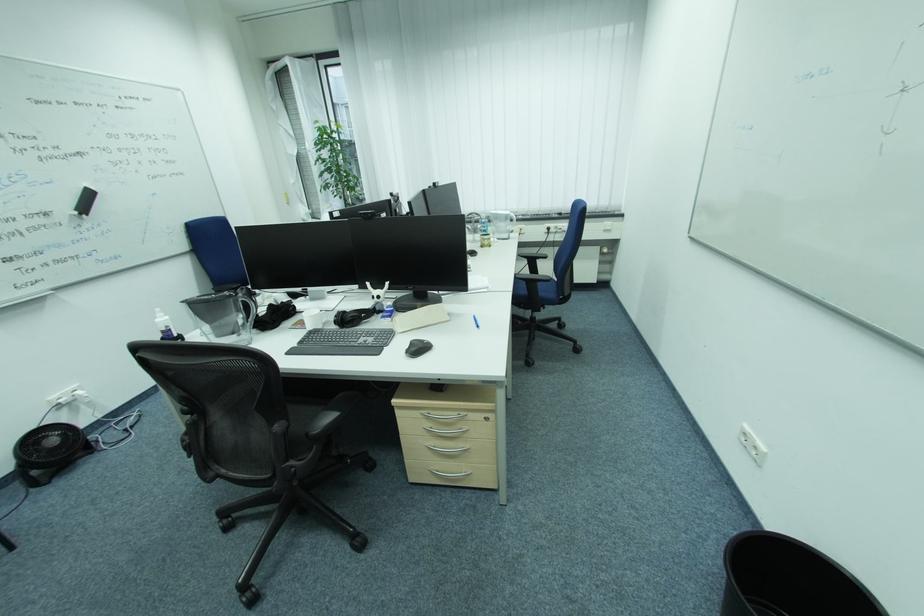
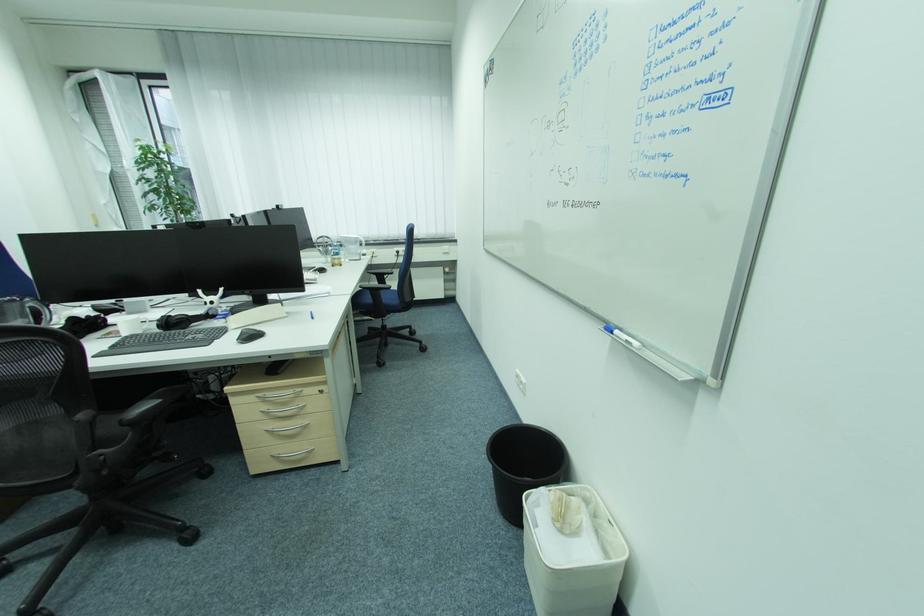
Question: I am providing you with two images of the same scene from different viewpoints. After the viewpoint changes to image2, which objects are now occluded?

Choices:
 (A) black headphones
 (B) plastic water bottle
 (C) white waste bin
 (D) none of these

Answer: (D)